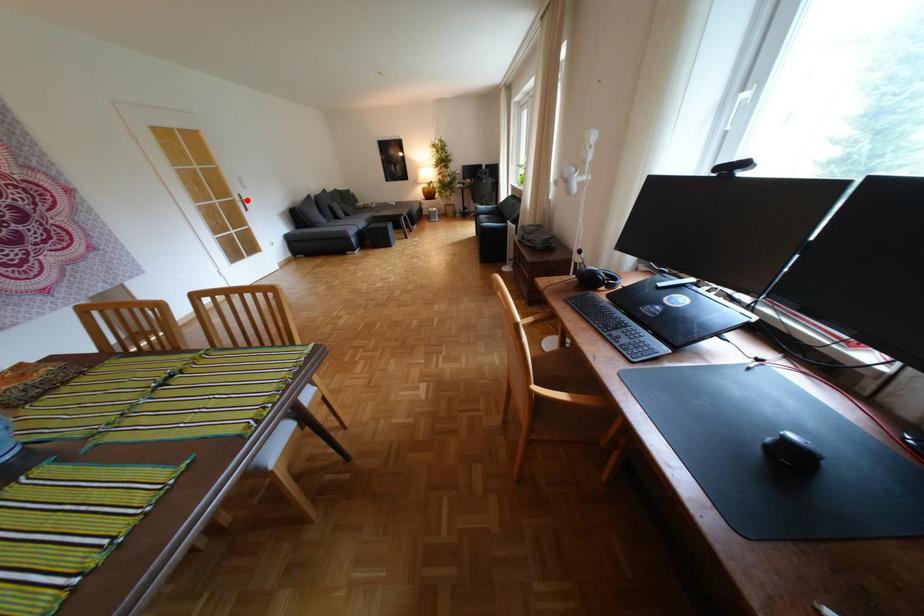
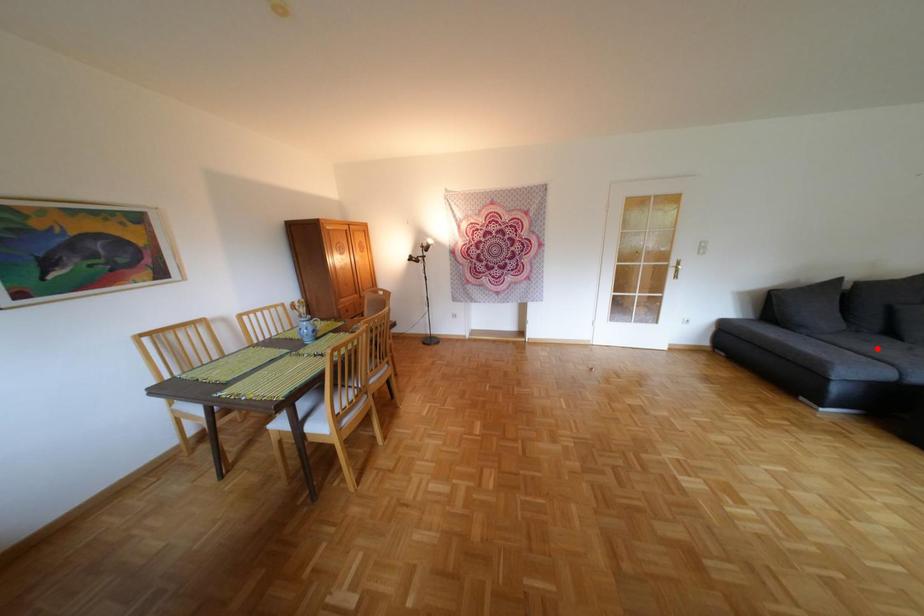
I am providing you with two images of the same scene from different viewpoints. A red point is marked on the first image and another point is marked on the second image. Do the highlighted points in image1 and image2 indicate the same real-world spot?

No